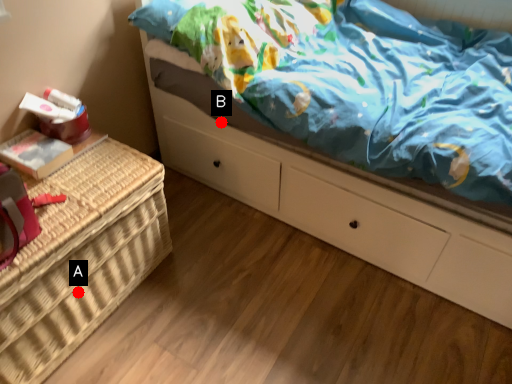
Question: Two points are circled on the image, labeled by A and B beside each circle. Which point appears closest to the camera in this image?

Choices:
 (A) A is closer
 (B) B is closer

Answer: (A)